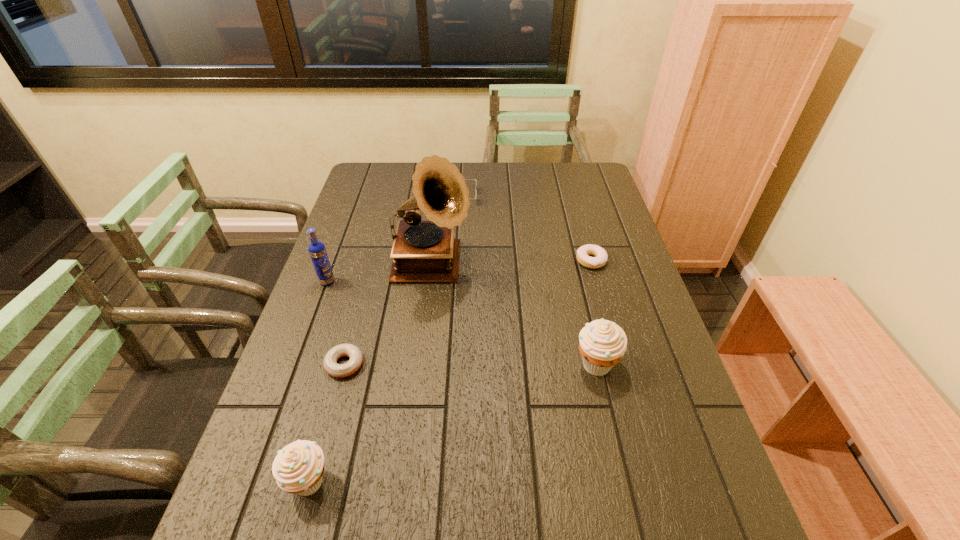
You are a GUI agent. You are given a task and a screenshot of the screen. Output one action in this format:
    pyautogui.click(x=<x>, y=<y>)
    Task: Click on the vacant space situated 0.240m on the right of the shorter muffin
    This screenshot has height=540, width=960.
    Given the screenshot: What is the action you would take?
    click(x=456, y=482)

At what (x,y) coordinates should I click in order to perform the action: click on blank space located 0.170m on the left of the right muffin. Please return your answer as a coordinate pair (x, y). Image resolution: width=960 pixels, height=540 pixels. Looking at the image, I should click on (502, 364).

Where is `vacant space located on the horn of the tallest object`? vacant space located on the horn of the tallest object is located at coordinates (498, 266).

At what (x,y) coordinates should I click in order to perform the action: click on free space located on the front-facing side of the sunglasses. Please return your answer as a coordinate pair (x, y). Image resolution: width=960 pixels, height=540 pixels. Looking at the image, I should click on (565, 197).

You are a GUI agent. You are given a task and a screenshot of the screen. Output one action in this format:
    pyautogui.click(x=<x>, y=<y>)
    Task: Click on the vacant region located on the front of the leftmost object
    Image resolution: width=960 pixels, height=540 pixels.
    Given the screenshot: What is the action you would take?
    pyautogui.click(x=320, y=302)

Find the location of a particular element. The height and width of the screenshot is (540, 960). vacant space located on the front of the nearer doughnut is located at coordinates (329, 420).

This screenshot has height=540, width=960. What are the coordinates of `vacant area situated 0.210m on the left of the right doughnut` in the screenshot? It's located at (506, 261).

In order to click on object present at the far edge in this screenshot , I will do `click(465, 179)`.

Identify the location of object that is positioned at the near edge. (298, 468).

The width and height of the screenshot is (960, 540). I want to click on muffin located at the left edge, so click(298, 468).